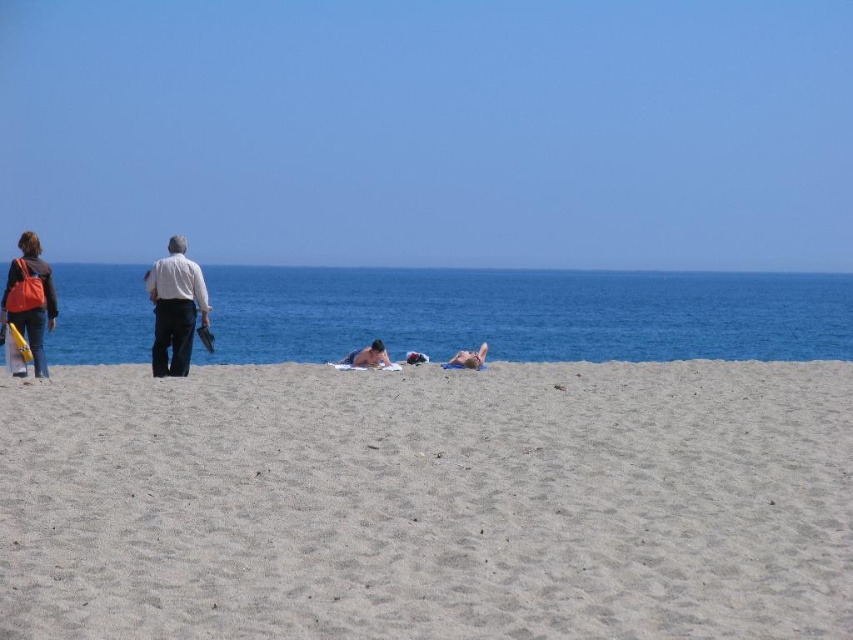
You are standing on the beach and see the white shirt at center and the matte orange bag at left. Which object is closer to you?

The white shirt at center is closer to you because it is further to the viewer than the matte orange bag at left.

You are standing on the beach and see the blue sky at upper center and the matte orange bag at left. Which object is positioned to the right of the other?

The blue sky at upper center is positioned to the right of the matte orange bag at left.